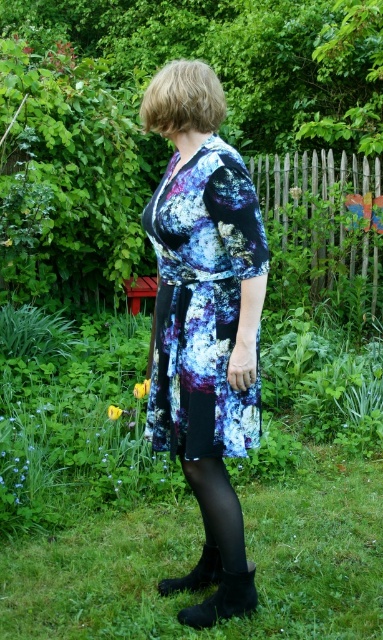
Consider the image. You are standing in the garden and want to place a small potted plant exactly where the green grass at lower center is located. According to the image, what are the coordinates of the location where you should place the potted plant?

The coordinates for the green grass at lower center are at point (x=166, y=513).

Consider the image. You are a photographer standing at a certain distance from the printed fabric dress at center. You want to capture a full body shot of the dress while ensuring the background remains in focus. Given that your camera has a depth of field that can keep objects within 2 meters in focus, will the background elements like the yellow flowers near the bottom left corner be in focus?

The printed fabric dress at center is 2.48 meters away from the viewer. Since the camera can keep objects within 2 meters in focus, the background elements like the yellow flowers near the bottom left corner would be beyond the 2 meter range and thus out of focus.

You are a photographer trying to capture the black suede boot at lower center and the black matte boot at lower center in a single shot. Which boot should you focus on first if you want to ensure both are in frame without moving the camera?

The black suede boot at lower center is located below the black matte boot at lower center, so you should focus on the black suede boot at lower center first to ensure both are in frame without moving the camera.